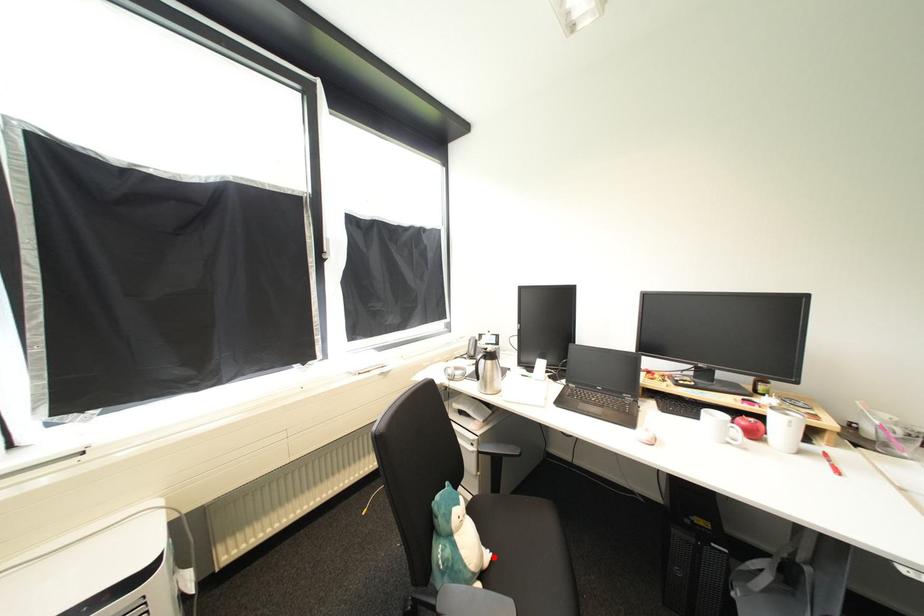
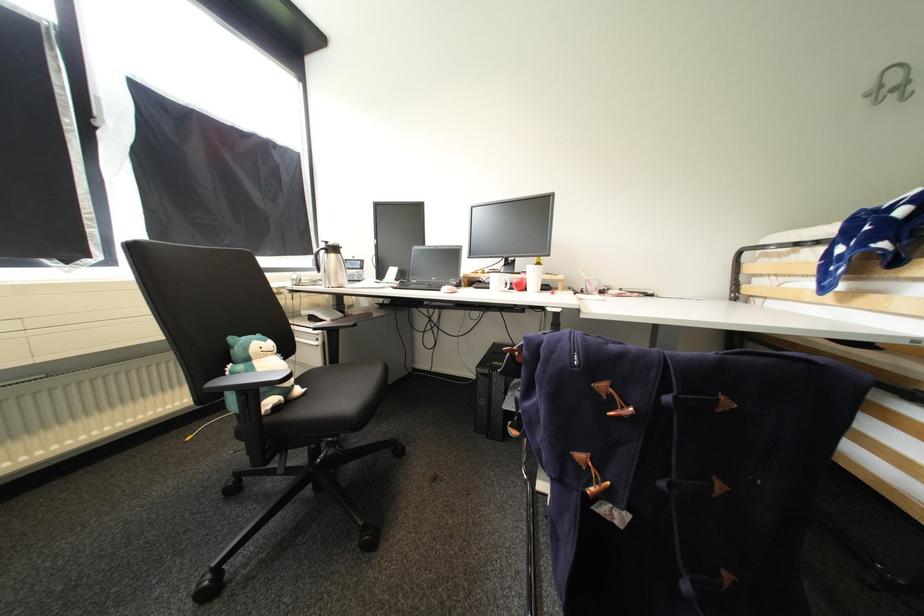
Question: I am providing you with two images of the same scene from different viewpoints. Image1 has a red point marked. In image2, the corresponding 3D location appears at what relative position? Reply with the corresponding letter.

Choices:
 (A) Closer
 (B) Farther

Answer: (A)